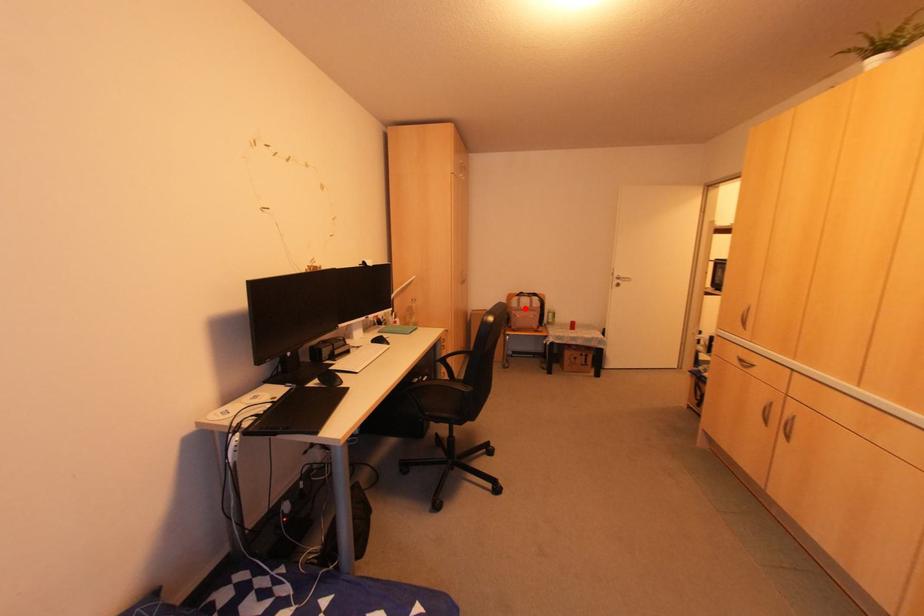
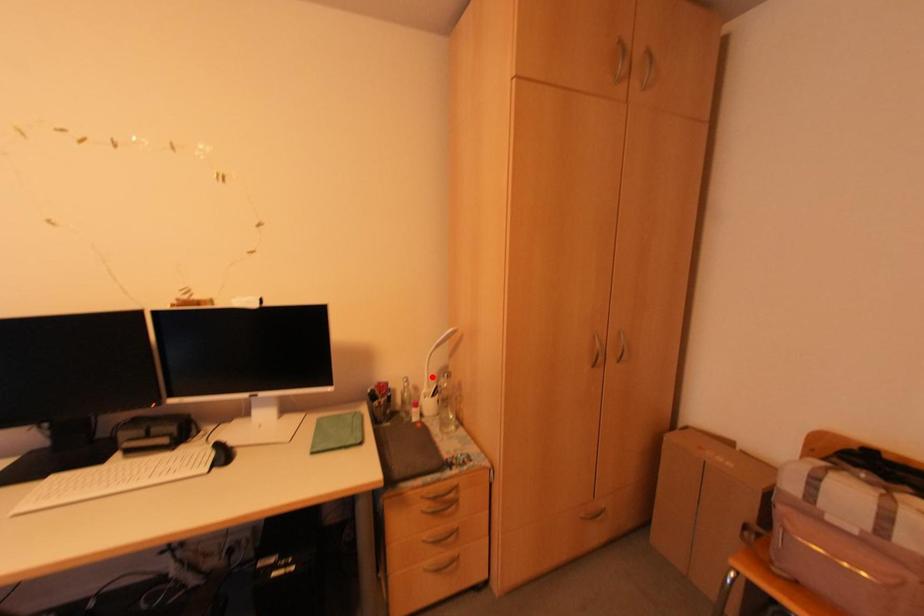
I am providing you with two images of the same scene from different viewpoints. A red point is marked on the first image and another point is marked on the second image. Do the highlighted points in image1 and image2 indicate the same real-world spot?

No